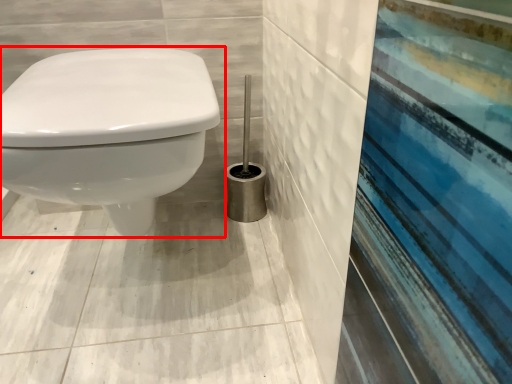
Question: Considering the relative positions of toilet (annotated by the red box) and brush in the image provided, where is toilet (annotated by the red box) located with respect to the staircase?

Choices:
 (A) left
 (B) right

Answer: (A)